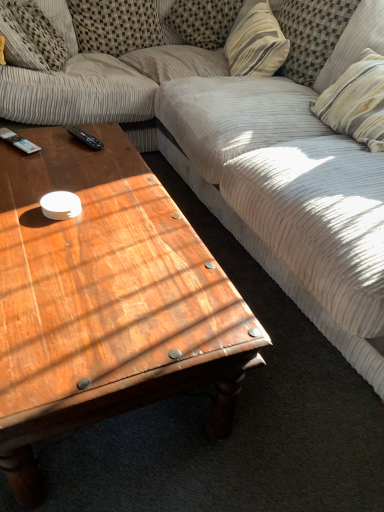
Question: Are black plastic remote control at upper left, the second remote control in the right-to-left sequence, and striped fabric pillow at upper center, which is counted as the third pillow, starting from the left, making contact?

Choices:
 (A) yes
 (B) no

Answer: (B)

Question: Is black plastic remote control at upper left, the second remote control in the right-to-left sequence, shorter than striped fabric pillow at upper center, which appears as the 4th pillow when viewed from the right?

Choices:
 (A) no
 (B) yes

Answer: (B)

Question: From a real-world perspective, is black plastic remote control at upper left, the second remote control in the right-to-left sequence, located higher than striped fabric pillow at upper center, which is counted as the third pillow, starting from the left?

Choices:
 (A) yes
 (B) no

Answer: (B)

Question: Does black plastic remote control at upper left, acting as the 1th remote control starting from the left, have a larger size compared to striped fabric pillow at upper center, which appears as the 4th pillow when viewed from the right?

Choices:
 (A) no
 (B) yes

Answer: (A)

Question: Considering the relative positions of black plastic remote control at upper left, acting as the 1th remote control starting from the left, and striped fabric pillow at upper center, which appears as the 4th pillow when viewed from the right, in the image provided, is black plastic remote control at upper left, acting as the 1th remote control starting from the left, to the left of striped fabric pillow at upper center, which appears as the 4th pillow when viewed from the right, from the viewer's perspective?

Choices:
 (A) no
 (B) yes

Answer: (B)

Question: In terms of height, does striped fabric pillow at upper right, acting as the first pillow starting from the right, look taller or shorter compared to striped fabric pillow at upper center, which appears as the 4th pillow when viewed from the left?

Choices:
 (A) short
 (B) tall

Answer: (B)

Question: Considering the positions of point (345, 64) and point (256, 19), is point (345, 64) closer or farther from the camera than point (256, 19)?

Choices:
 (A) closer
 (B) farther

Answer: (A)

Question: From the image's perspective, is striped fabric pillow at upper right, which appears as the 6th pillow when viewed from the left, positioned above or below striped fabric pillow at upper center, the third pillow viewed from the right?

Choices:
 (A) below
 (B) above

Answer: (A)

Question: From a real-world perspective, is striped fabric pillow at upper right, which appears as the 6th pillow when viewed from the left, positioned above or below striped fabric pillow at upper center, which appears as the 4th pillow when viewed from the left?

Choices:
 (A) below
 (B) above

Answer: (B)

Question: Considering the relative positions of striped fabric pillow at upper right, which is the fifth pillow from left to right, and striped fabric pillow at upper center, which appears as the 4th pillow when viewed from the left, in the image provided, is striped fabric pillow at upper right, which is the fifth pillow from left to right, to the left or to the right of striped fabric pillow at upper center, which appears as the 4th pillow when viewed from the left,?

Choices:
 (A) left
 (B) right

Answer: (B)

Question: In the image, is striped fabric pillow at upper right, which is the fifth pillow from left to right, positioned in front of or behind striped fabric pillow at upper center, the third pillow viewed from the right?

Choices:
 (A) behind
 (B) front

Answer: (B)

Question: Considering the positions of point (292, 17) and point (253, 50), is point (292, 17) closer or farther from the camera than point (253, 50)?

Choices:
 (A) closer
 (B) farther

Answer: (A)

Question: From the image's perspective, is striped fabric pillow at upper right, which is the fifth pillow from left to right, located above or below striped fabric pillow at upper center, the third pillow viewed from the right?

Choices:
 (A) above
 (B) below

Answer: (B)

Question: From a real-world perspective, relative to wooden coffee table at center, is striped fabric pillow at upper center, which is counted as the third pillow, starting from the left, vertically above or below?

Choices:
 (A) below
 (B) above

Answer: (B)

Question: Looking at the image, does striped fabric pillow at upper center, which is counted as the third pillow, starting from the left, seem bigger or smaller compared to wooden coffee table at center?

Choices:
 (A) small
 (B) big

Answer: (A)